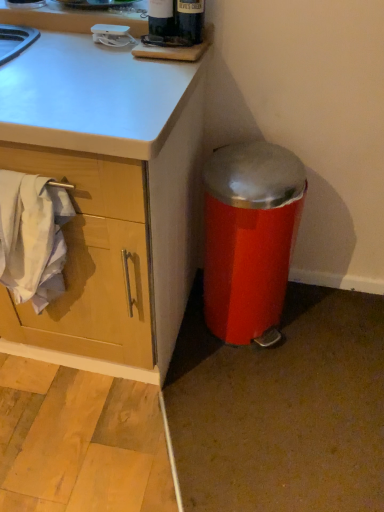
Where is `metallic red trash can at lower right`? metallic red trash can at lower right is located at coordinates (250, 238).

Can you tell me how much metallic red trash can at lower right and dark glass bottle at upper center differ in facing direction?

There is a 1.74-degree angle between the facing directions of metallic red trash can at lower right and dark glass bottle at upper center.

Would you say metallic red trash can at lower right is inside or outside dark glass bottle at upper center?

metallic red trash can at lower right is outside dark glass bottle at upper center.

From a real-world perspective, who is located higher, metallic red trash can at lower right or dark glass bottle at upper center?

dark glass bottle at upper center.

Is metallic red trash can at lower right next to dark glass bottle at upper center and touching it?

No, metallic red trash can at lower right is not making contact with dark glass bottle at upper center.

Who is taller, metallic red trash can at lower right or white cotton towel at left?

metallic red trash can at lower right.

How many degrees apart are the facing directions of metallic red trash can at lower right and white cotton towel at left?

The angular difference between metallic red trash can at lower right and white cotton towel at left is 0.17 degrees.

Is metallic red trash can at lower right oriented away from white cotton towel at left?

That's not correct — metallic red trash can at lower right is not looking away from white cotton towel at left.

Is metallic red trash can at lower right touching white cotton towel at left?

No, metallic red trash can at lower right is not touching white cotton towel at left.

Which is in front, dark glass bottle at upper center or metallic red trash can at lower right?

dark glass bottle at upper center is in front.

Considering the relative sizes of dark glass bottle at upper center and metallic red trash can at lower right in the image provided, is dark glass bottle at upper center bigger than metallic red trash can at lower right?

Actually, dark glass bottle at upper center might be smaller than metallic red trash can at lower right.

What's the angular difference between dark glass bottle at upper center and metallic red trash can at lower right's facing directions?

They differ by 1.74 degrees in their facing directions.

Does dark glass bottle at upper center have a greater width compared to metallic red trash can at lower right?

No, dark glass bottle at upper center is not wider than metallic red trash can at lower right.

Would you consider white cotton towel at left to be distant from metallic red trash can at lower right?

No, white cotton towel at left is not far from metallic red trash can at lower right.

Visually, is white cotton towel at left positioned to the left or to the right of metallic red trash can at lower right?

Clearly, white cotton towel at left is on the left of metallic red trash can at lower right in the image.

How different are the orientations of white cotton towel at left and metallic red trash can at lower right in degrees?

The facing directions of white cotton towel at left and metallic red trash can at lower right are 0.17 degrees apart.

From the picture: Could metallic red trash can at lower right be considered to be inside white cotton towel at left?

No, metallic red trash can at lower right is not surrounded by white cotton towel at left.

In the scene shown: Between white cotton towel at left and dark glass bottle at upper center, which one appears on the left side from the viewer's perspective?

Positioned to the left is white cotton towel at left.

How different are the orientations of white cotton towel at left and dark glass bottle at upper center in degrees?

The angular difference between white cotton towel at left and dark glass bottle at upper center is 1.91 degrees.

Considering the sizes of objects white cotton towel at left and dark glass bottle at upper center in the image provided, who is shorter, white cotton towel at left or dark glass bottle at upper center?

With less height is dark glass bottle at upper center.

Would you say dark glass bottle at upper center is part of white cotton towel at left's contents?

No, dark glass bottle at upper center is not a part of white cotton towel at left.

Is dark glass bottle at upper center far away from white cotton towel at left?

No, dark glass bottle at upper center is not far from white cotton towel at left.

Is dark glass bottle at upper center further to the viewer compared to white cotton towel at left?

Yes, the depth of dark glass bottle at upper center is greater than that of white cotton towel at left.

Could white cotton towel at left be considered to be inside dark glass bottle at upper center?

No, dark glass bottle at upper center does not contain white cotton towel at left.

Image resolution: width=384 pixels, height=512 pixels. In order to click on bottle in front of the metallic red trash can at lower right in this screenshot , I will do `click(175, 22)`.

At what (x,y) coordinates should I click in order to perform the action: click on trash bin/can on the right of white cotton towel at left. Please return your answer as a coordinate pair (x, y). Looking at the image, I should click on (250, 238).

Considering their positions, is white cotton towel at left positioned further to metallic red trash can at lower right than dark glass bottle at upper center?

dark glass bottle at upper center is further to metallic red trash can at lower right.

From the image, which object appears to be farther from dark glass bottle at upper center, metallic red trash can at lower right or white cotton towel at left?

Based on the image, white cotton towel at left appears to be further to dark glass bottle at upper center.

Estimate the real-world distances between objects in this image. Which object is further from metallic red trash can at lower right, dark glass bottle at upper center or white cotton towel at left?

The object further to metallic red trash can at lower right is dark glass bottle at upper center.

Based on their spatial positions, is metallic red trash can at lower right or dark glass bottle at upper center further from white cotton towel at left?

dark glass bottle at upper center is positioned further to the anchor white cotton towel at left.

Which object lies further to the anchor point white cotton towel at left, dark glass bottle at upper center or metallic red trash can at lower right?

dark glass bottle at upper center is positioned further to the anchor white cotton towel at left.

Which object lies further to the anchor point dark glass bottle at upper center, white cotton towel at left or metallic red trash can at lower right?

white cotton towel at left.

Identify the location of trash bin/can between dark glass bottle at upper center and white cotton towel at left from top to bottom. (250, 238).